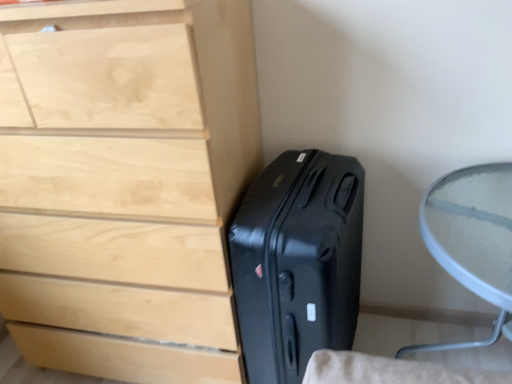
This screenshot has width=512, height=384. I want to click on transparent glass table at right, so click(472, 237).

Identify the location of light wood chest of drawers at left. (125, 184).

Identify the location of black hardshell suitcase at lower right. This screenshot has width=512, height=384. (297, 262).

Is transparent glass table at right facing away from black hardshell suitcase at lower right?

No, transparent glass table at right is not facing away from black hardshell suitcase at lower right.

Is transparent glass table at right far away from black hardshell suitcase at lower right?

No, transparent glass table at right is not far away from black hardshell suitcase at lower right.

Does transparent glass table at right come behind black hardshell suitcase at lower right?

No, it is not.

Where is `suitcase lying behind the transparent glass table at right`? The height and width of the screenshot is (384, 512). suitcase lying behind the transparent glass table at right is located at coordinates (297, 262).

How many degrees apart are the facing directions of black hardshell suitcase at lower right and transparent glass table at right?

The angle between the facing direction of black hardshell suitcase at lower right and the facing direction of transparent glass table at right is 6.35e-05 degrees.

Considering the sizes of black hardshell suitcase at lower right and transparent glass table at right in the image, is black hardshell suitcase at lower right taller or shorter than transparent glass table at right?

Considering their sizes, black hardshell suitcase at lower right has more height than transparent glass table at right.

From the image's perspective, is black hardshell suitcase at lower right over transparent glass table at right?

Indeed, from the image's perspective, black hardshell suitcase at lower right is shown above transparent glass table at right.

Relative to transparent glass table at right, is black hardshell suitcase at lower right in front or behind?

black hardshell suitcase at lower right is behind transparent glass table at right.

Can you confirm if light wood chest of drawers at left is wider than transparent glass table at right?

In fact, light wood chest of drawers at left might be narrower than transparent glass table at right.

From a real-world perspective, who is located lower, light wood chest of drawers at left or transparent glass table at right?

transparent glass table at right, from a real-world perspective.

This screenshot has height=384, width=512. I want to click on the chest of drawers located above the transparent glass table at right (from the image's perspective), so click(125, 184).

Measure the distance from transparent glass table at right to light wood chest of drawers at left.

A distance of 30.69 inches exists between transparent glass table at right and light wood chest of drawers at left.

From a real-world perspective, does transparent glass table at right stand above light wood chest of drawers at left?

No, from a real-world perspective, transparent glass table at right is not above light wood chest of drawers at left.

Between transparent glass table at right and light wood chest of drawers at left, which one has less height?

With less height is transparent glass table at right.

Is transparent glass table at right aimed at light wood chest of drawers at left?

No.

How many degrees apart are the facing directions of light wood chest of drawers at left and black hardshell suitcase at lower right?

There is a 0.688-degree angle between the facing directions of light wood chest of drawers at left and black hardshell suitcase at lower right.

Is point (58, 104) positioned behind point (230, 236)?

No, it is not.

Considering the sizes of light wood chest of drawers at left and black hardshell suitcase at lower right in the image, is light wood chest of drawers at left wider or thinner than black hardshell suitcase at lower right?

light wood chest of drawers at left is thinner than black hardshell suitcase at lower right.

Is light wood chest of drawers at left positioned beyond the bounds of black hardshell suitcase at lower right?

Yes.

Consider the image. Based on their sizes in the image, would you say black hardshell suitcase at lower right is bigger or smaller than light wood chest of drawers at left?

In the image, black hardshell suitcase at lower right appears to be smaller than light wood chest of drawers at left.

Which is behind, point (228, 236) or point (183, 21)?

The point (228, 236) is more distant.

Measure the distance from black hardshell suitcase at lower right to light wood chest of drawers at left.

black hardshell suitcase at lower right and light wood chest of drawers at left are 11.66 inches apart.

Considering the relative sizes of black hardshell suitcase at lower right and light wood chest of drawers at left in the image provided, is black hardshell suitcase at lower right shorter than light wood chest of drawers at left?

Yes, black hardshell suitcase at lower right is shorter than light wood chest of drawers at left.

Identify the location of suitcase on the left of transparent glass table at right. (297, 262).

The height and width of the screenshot is (384, 512). What are the coordinates of `round table on the right of black hardshell suitcase at lower right` in the screenshot? It's located at (472, 237).

From the image, which object appears to be nearer to black hardshell suitcase at lower right, light wood chest of drawers at left or transparent glass table at right?

Based on the image, light wood chest of drawers at left appears to be nearer to black hardshell suitcase at lower right.

From the picture: Based on their spatial positions, is transparent glass table at right or light wood chest of drawers at left closer to black hardshell suitcase at lower right?

Based on the image, light wood chest of drawers at left appears to be nearer to black hardshell suitcase at lower right.

Estimate the real-world distances between objects in this image. Which object is closer to light wood chest of drawers at left, black hardshell suitcase at lower right or transparent glass table at right?

black hardshell suitcase at lower right lies closer to light wood chest of drawers at left than the other object.

Estimate the real-world distances between objects in this image. Which object is closer to transparent glass table at right, black hardshell suitcase at lower right or light wood chest of drawers at left?

The object closer to transparent glass table at right is black hardshell suitcase at lower right.

When comparing their distances from transparent glass table at right, does light wood chest of drawers at left or black hardshell suitcase at lower right seem further?

Among the two, light wood chest of drawers at left is located further to transparent glass table at right.

Looking at the image, which one is located further to light wood chest of drawers at left, transparent glass table at right or black hardshell suitcase at lower right?

transparent glass table at right lies further to light wood chest of drawers at left than the other object.

You are a GUI agent. You are given a task and a screenshot of the screen. Output one action in this format:
    pyautogui.click(x=<x>, y=<y>)
    Task: Click on the suitcase located between light wood chest of drawers at left and transparent glass table at right in the left-right direction
    This screenshot has width=512, height=384.
    Given the screenshot: What is the action you would take?
    pyautogui.click(x=297, y=262)